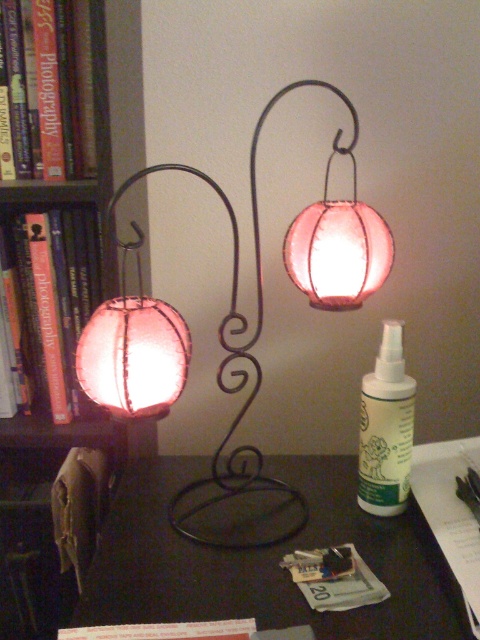
Question: Is matte wood bookshelf at left to the left of matte glass lantern at center from the viewer's perspective?

Choices:
 (A) yes
 (B) no

Answer: (A)

Question: Which object appears closest to the camera in this image?

Choices:
 (A) white plastic spray bottle at center-right
 (B) black matte table at center
 (C) matte wood bookshelf at left

Answer: (B)

Question: Which point is closer to the camera taking this photo?

Choices:
 (A) (330, 227)
 (B) (149, 384)
 (C) (411, 550)

Answer: (B)

Question: Can you confirm if black matte table at center is smaller than matte wood bookshelf at left?

Choices:
 (A) no
 (B) yes

Answer: (B)

Question: Is black matte table at center positioned at the back of white plastic spray bottle at center-right?

Choices:
 (A) yes
 (B) no

Answer: (B)

Question: Which of these objects is positioned farthest from the matte pink paper lantern at upper right?

Choices:
 (A) white plastic spray bottle at center-right
 (B) matte wood bookshelf at left
 (C) matte glass lantern at center
 (D) black matte table at center

Answer: (D)